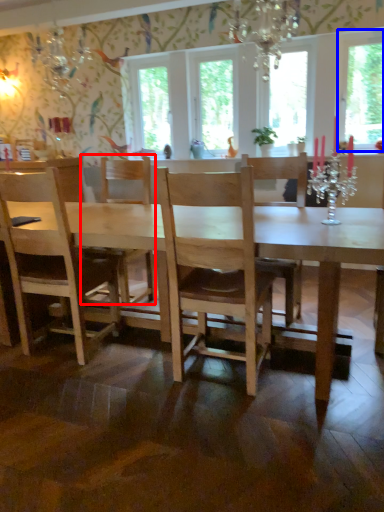
Question: Which object appears closest to the camera in this image, chair (highlighted by a red box) or window screen (highlighted by a blue box)?

Choices:
 (A) chair
 (B) window screen

Answer: (A)